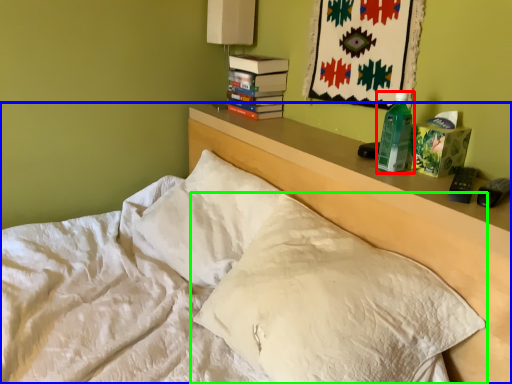
Question: Considering the real-world distances, which object is farthest from bottle (highlighted by a red box)? bed (highlighted by a blue box) or pillow (highlighted by a green box)?

Choices:
 (A) bed
 (B) pillow

Answer: (B)